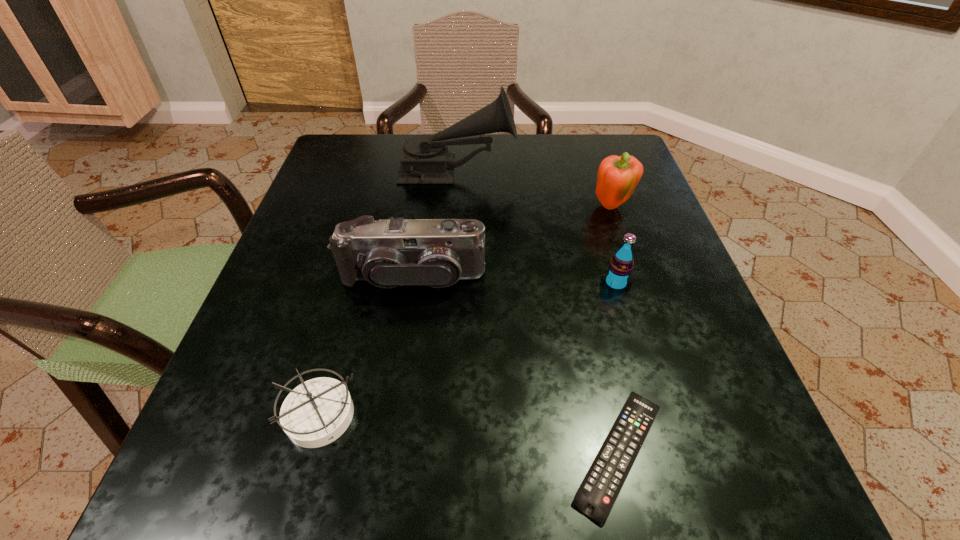
At what (x,y) coordinates should I click in order to perform the action: click on the tallest object. Please return your answer as a coordinate pair (x, y). Looking at the image, I should click on (425, 159).

The height and width of the screenshot is (540, 960). In order to click on phonograph_record in this screenshot , I will do `click(425, 159)`.

The height and width of the screenshot is (540, 960). Identify the location of the fifth nearest object. (618, 176).

Image resolution: width=960 pixels, height=540 pixels. I want to click on camcorder, so click(x=389, y=253).

The width and height of the screenshot is (960, 540). What are the coordinates of `soda` in the screenshot? It's located at (617, 277).

This screenshot has width=960, height=540. I want to click on the fifth tallest object, so click(317, 412).

You are a GUI agent. You are given a task and a screenshot of the screen. Output one action in this format:
    pyautogui.click(x=<x>, y=<y>)
    Task: Click on the shortest object
    This screenshot has width=960, height=540.
    Given the screenshot: What is the action you would take?
    pyautogui.click(x=596, y=495)

Find the location of a particular element. vacant space located 0.050m from the horn of the phonograph_record is located at coordinates (537, 172).

Locate an element on the screen. vacant space located on the back of the fifth nearest object is located at coordinates (592, 150).

At what (x,y) coordinates should I click in order to perform the action: click on vacant space located 0.240m on the front-facing side of the camcorder. Please return your answer as a coordinate pair (x, y). Looking at the image, I should click on click(390, 435).